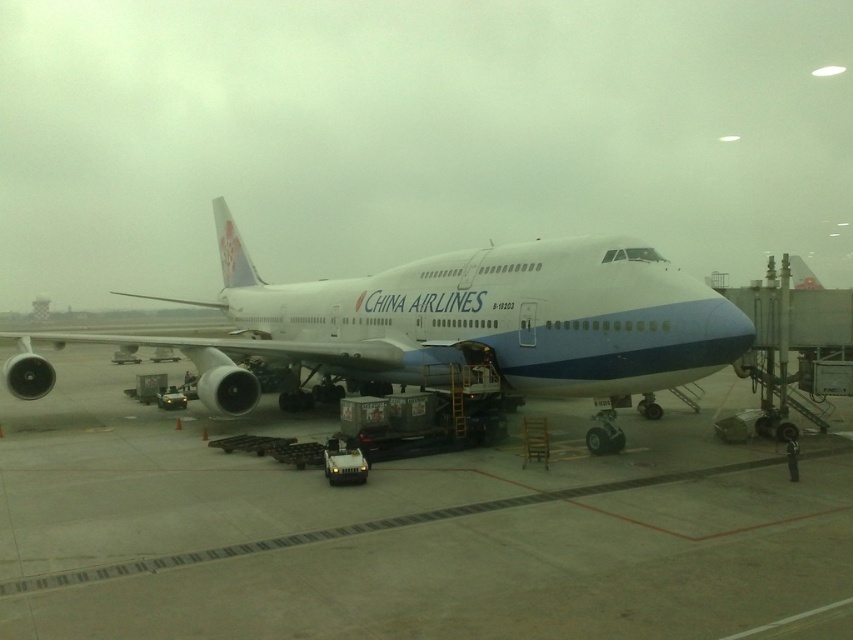
Question: Which of the following is the farthest from the observer?

Choices:
 (A) (608, 390)
 (B) (663, 525)

Answer: (A)

Question: Can you confirm if smooth concrete tarmac at center is positioned to the right of white glossy airplane at center?

Choices:
 (A) yes
 (B) no

Answer: (A)

Question: Which point is farther to the camera?

Choices:
 (A) white glossy airplane at center
 (B) smooth concrete tarmac at center

Answer: (A)

Question: Does smooth concrete tarmac at center have a greater width compared to white glossy airplane at center?

Choices:
 (A) yes
 (B) no

Answer: (B)

Question: Does smooth concrete tarmac at center appear on the left side of white glossy airplane at center?

Choices:
 (A) no
 (B) yes

Answer: (A)